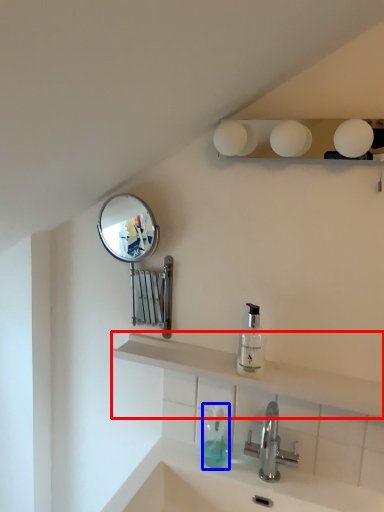
Question: Which of the following is the closest to the observer, shelve (highlighted by a red box) or soap dispenser (highlighted by a blue box)?

Choices:
 (A) shelve
 (B) soap dispenser

Answer: (A)